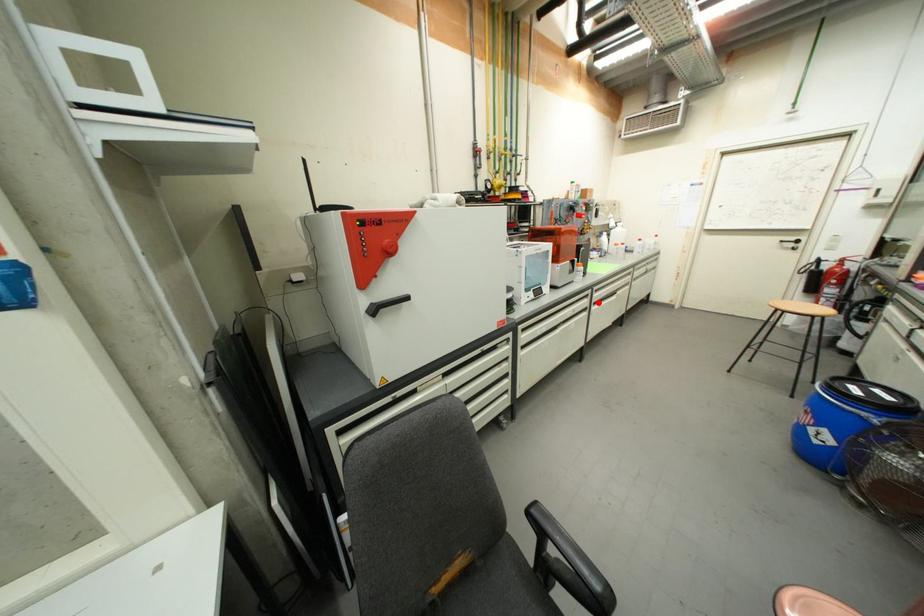
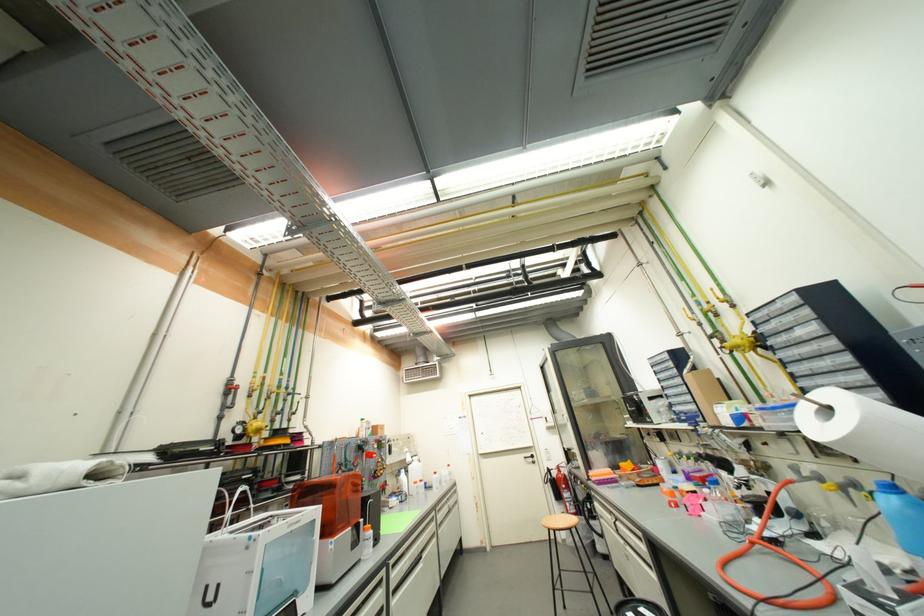
Where in the second image is the point corresponding to the highlighted location from the first image?

(396, 590)